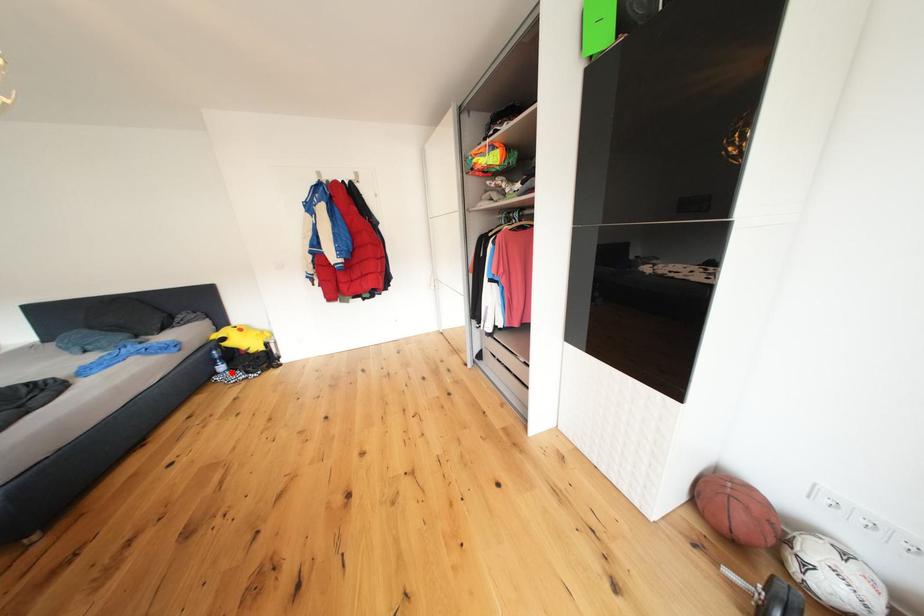
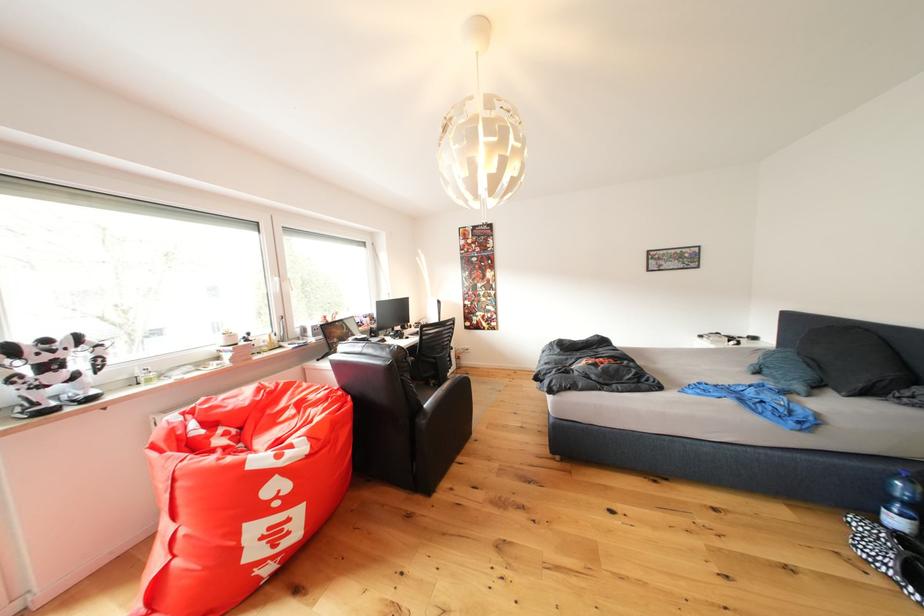
Find the pixel in the second image that matches the highlighted location in the first image.

(906, 527)